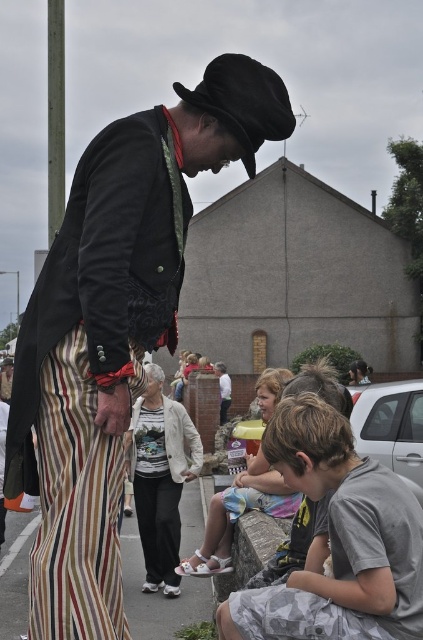
Question: Does white cotton shirt at center have a smaller size compared to light brown wooden bench at lower center?

Choices:
 (A) no
 (B) yes

Answer: (B)

Question: Observing the image, what is the correct spatial positioning of gray cotton t-shirt at lower right in reference to light brown wooden bench at lower center?

Choices:
 (A) left
 (B) right

Answer: (B)

Question: Which of the following is the closest to the observer?

Choices:
 (A) black felt fedora at upper center
 (B) gray cotton t-shirt at lower right

Answer: (B)

Question: Can you confirm if white cotton shirt at center is thinner than striped fabric pavement at lower left?

Choices:
 (A) yes
 (B) no

Answer: (A)

Question: Considering the real-world distances, which object is closest to the black felt fedora at upper center?

Choices:
 (A) light brown wooden bench at lower center
 (B) striped fabric pants at center

Answer: (B)

Question: Considering the real-world distances, which object is farthest from the light brown wooden bench at lower center?

Choices:
 (A) gray cotton t-shirt at lower right
 (B) striped fabric pants at center

Answer: (B)